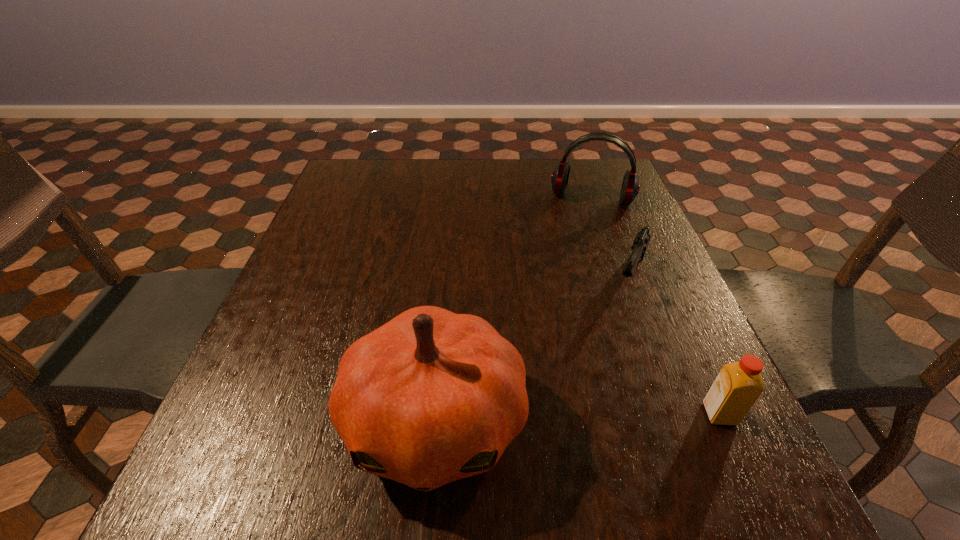
Identify the location of the leftmost object. The height and width of the screenshot is (540, 960). (431, 397).

You are a GUI agent. You are given a task and a screenshot of the screen. Output one action in this format:
    pyautogui.click(x=<x>, y=<y>)
    Task: Click on the pumpkin
    The height and width of the screenshot is (540, 960).
    Given the screenshot: What is the action you would take?
    pyautogui.click(x=431, y=397)

You are a GUI agent. You are given a task and a screenshot of the screen. Output one action in this format:
    pyautogui.click(x=<x>, y=<y>)
    Task: Click on the third tallest object
    
    Given the screenshot: What is the action you would take?
    pyautogui.click(x=737, y=387)

What are the coordinates of `the third nearest object` in the screenshot? It's located at (642, 239).

You are a GUI agent. You are given a task and a screenshot of the screen. Output one action in this format:
    pyautogui.click(x=<x>, y=<y>)
    Task: Click on the shortest object
    The height and width of the screenshot is (540, 960).
    Given the screenshot: What is the action you would take?
    pyautogui.click(x=642, y=239)

Where is `earphone`? earphone is located at coordinates (630, 187).

At what (x,y) coordinates should I click in order to perform the action: click on the farthest object. Please return your answer as a coordinate pair (x, y). Looking at the image, I should click on (630, 187).

Image resolution: width=960 pixels, height=540 pixels. What are the coordinates of `vacant space situated at the end of the barrel of the shortest object` in the screenshot? It's located at (612, 341).

This screenshot has width=960, height=540. Find the location of `vacant space situated 0.300m at the end of the barrel of the shortest object`. vacant space situated 0.300m at the end of the barrel of the shortest object is located at coordinates (584, 413).

I want to click on free space located 0.240m at the end of the barrel of the shortest object, so click(594, 387).